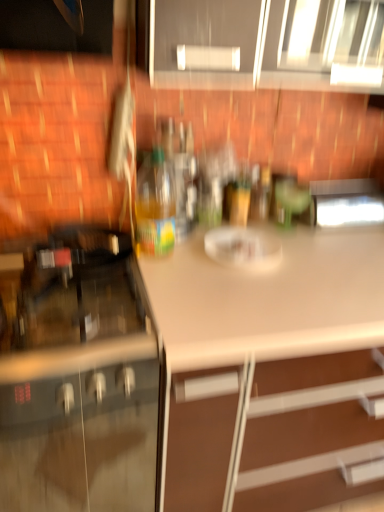
This screenshot has height=512, width=384. Find the location of `vacant space in front of metallic stainless steel microwave at upper right`. vacant space in front of metallic stainless steel microwave at upper right is located at coordinates (345, 244).